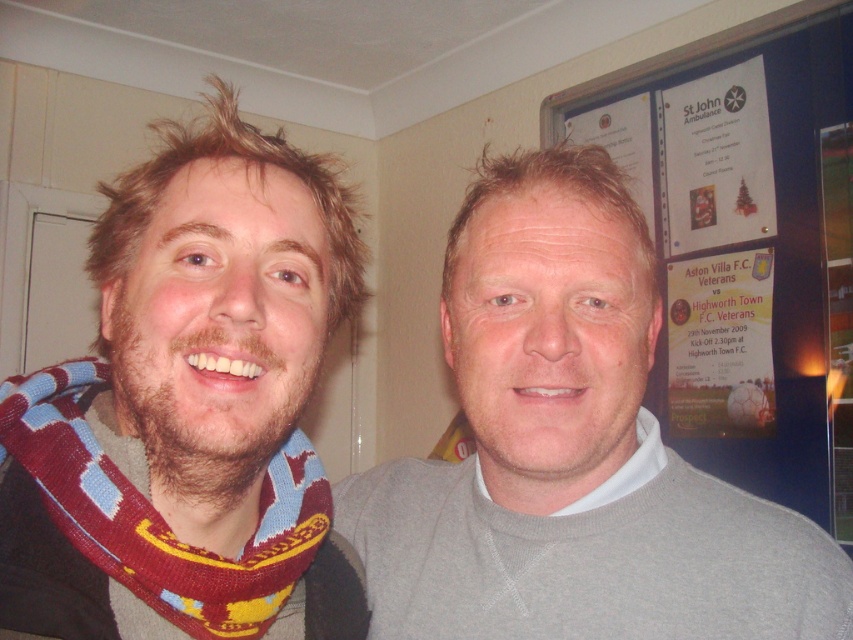
Question: Which point is closer to the camera?

Choices:
 (A) (670, 397)
 (B) (132, 576)

Answer: (B)

Question: Does gray matte sweater at center have a greater width compared to white paper poster at upper right?

Choices:
 (A) no
 (B) yes

Answer: (A)

Question: Is gray matte sweater at center thinner than white paper poster at upper right?

Choices:
 (A) yes
 (B) no

Answer: (A)

Question: Which object is positioned closest to the knitted scarf at left?

Choices:
 (A) gray matte sweater at center
 (B) white paper poster at upper right

Answer: (A)

Question: Is the position of knitted scarf at left less distant than that of white paper poster at upper right?

Choices:
 (A) yes
 (B) no

Answer: (A)

Question: Which point is closer to the camera?

Choices:
 (A) gray matte sweater at center
 (B) white paper poster at upper right
 (C) knitted scarf at left

Answer: (C)